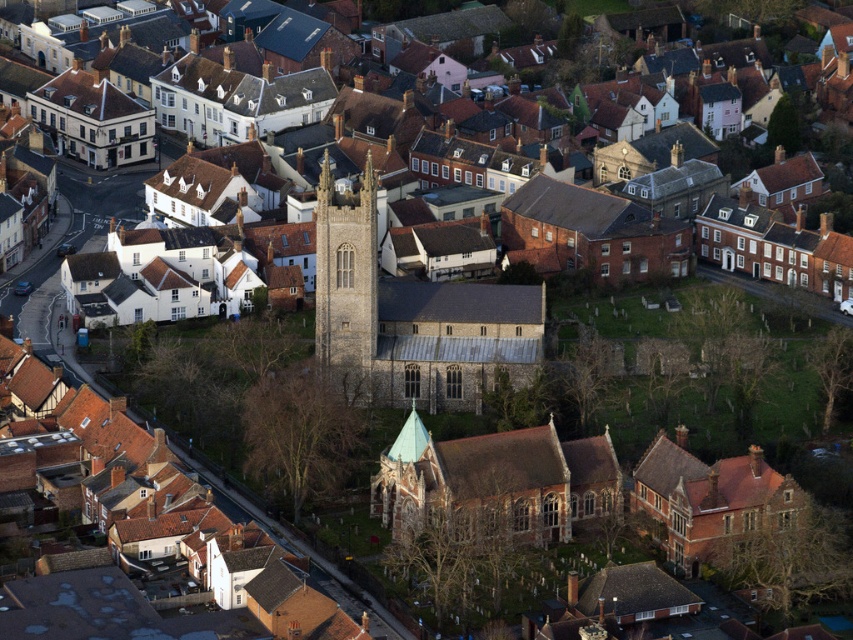
Question: Which of the following is the farthest from the observer?

Choices:
 (A) click(325, 285)
 (B) click(439, 376)

Answer: (B)

Question: Estimate the real-world distances between objects in this image. Which object is closer to the brown brick church at lower center?

Choices:
 (A) stone church at center
 (B) dark gray stone tower at center

Answer: (A)

Question: Does brown brick church at lower center appear over stone church at center?

Choices:
 (A) no
 (B) yes

Answer: (A)

Question: Where is brown brick church at lower center located in relation to stone church at center in the image?

Choices:
 (A) below
 (B) above

Answer: (A)

Question: Can you confirm if brown brick church at lower center is positioned to the right of dark gray stone tower at center?

Choices:
 (A) no
 (B) yes

Answer: (B)

Question: Which object is farther from the camera taking this photo?

Choices:
 (A) dark gray stone tower at center
 (B) brown brick church at lower center
 (C) stone church at center

Answer: (C)